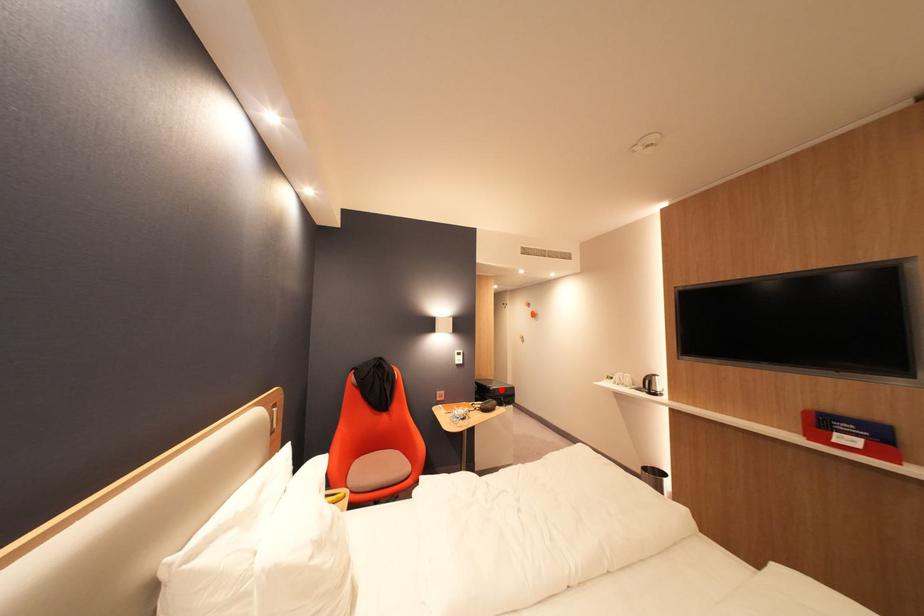
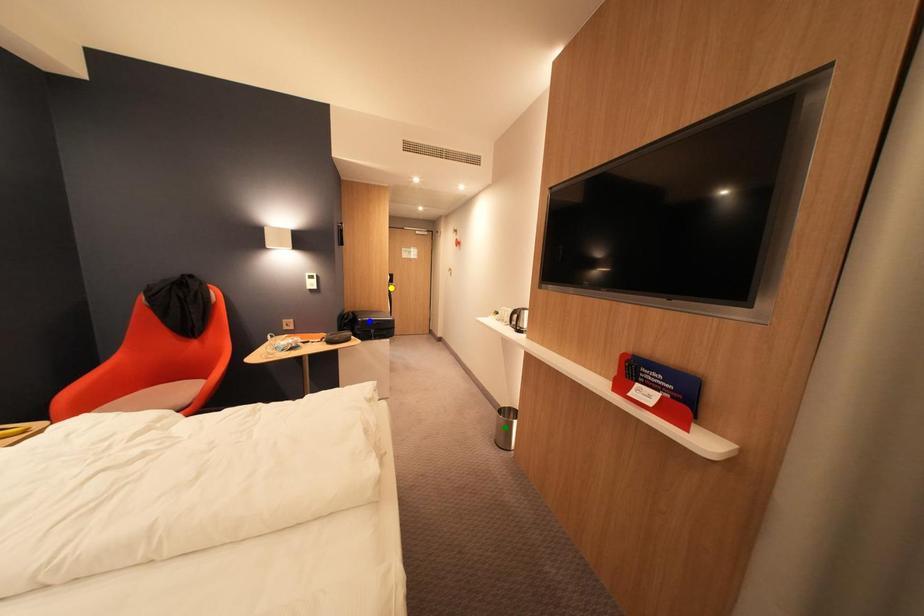
Question: I am providing you with two images of the same scene from different viewpoints. A red point is marked on the first image. You are given multiple points on the second image. Which spot in image 2 lines up with the point in image 1?

Choices:
 (A) green point
 (B) yellow point
 (C) blue point

Answer: (C)